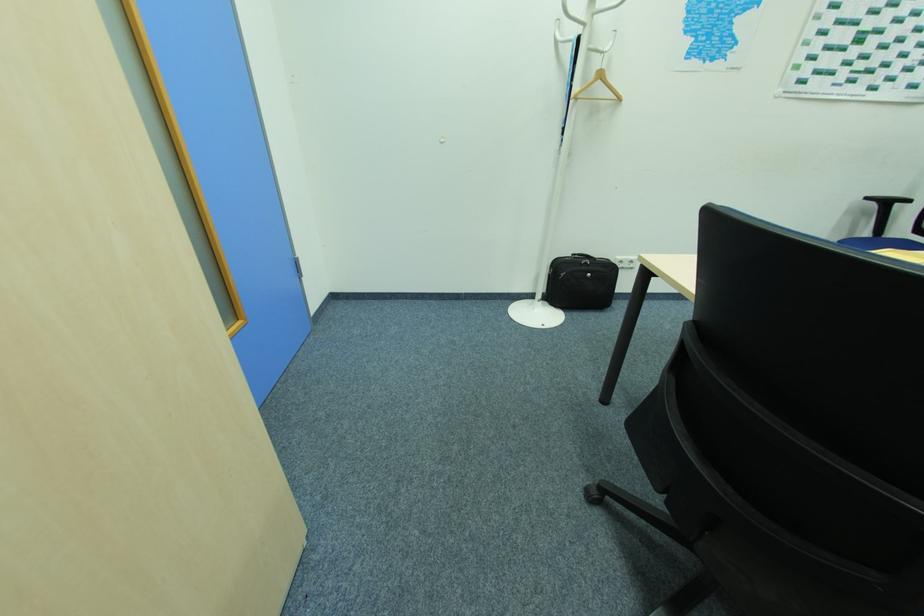
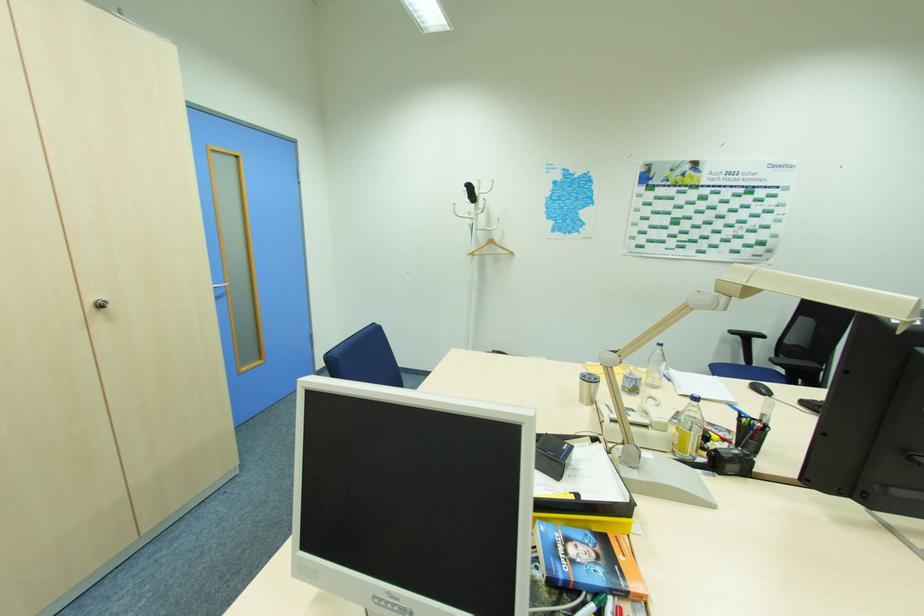
The point at (870, 199) is marked in the first image. Where is the corresponding point in the second image?

(734, 331)